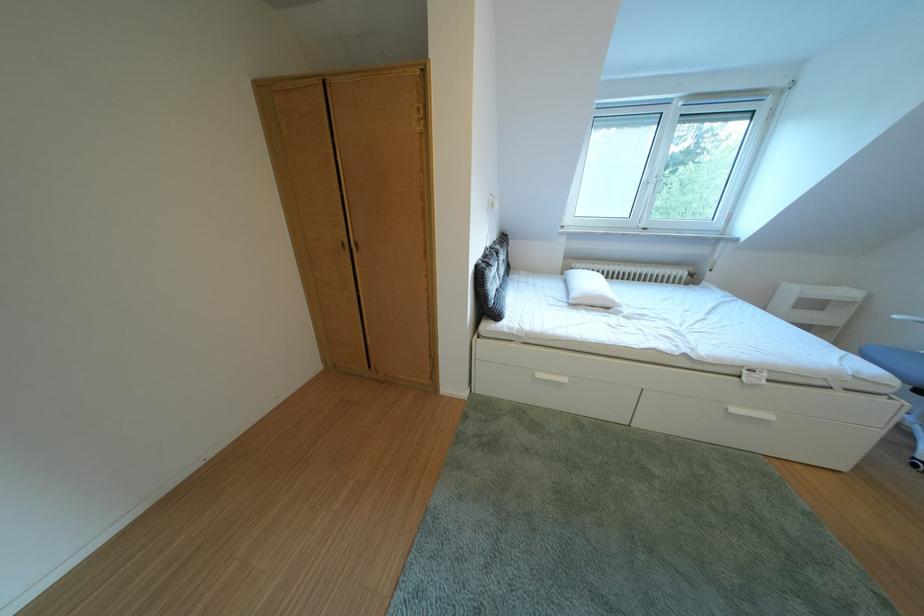
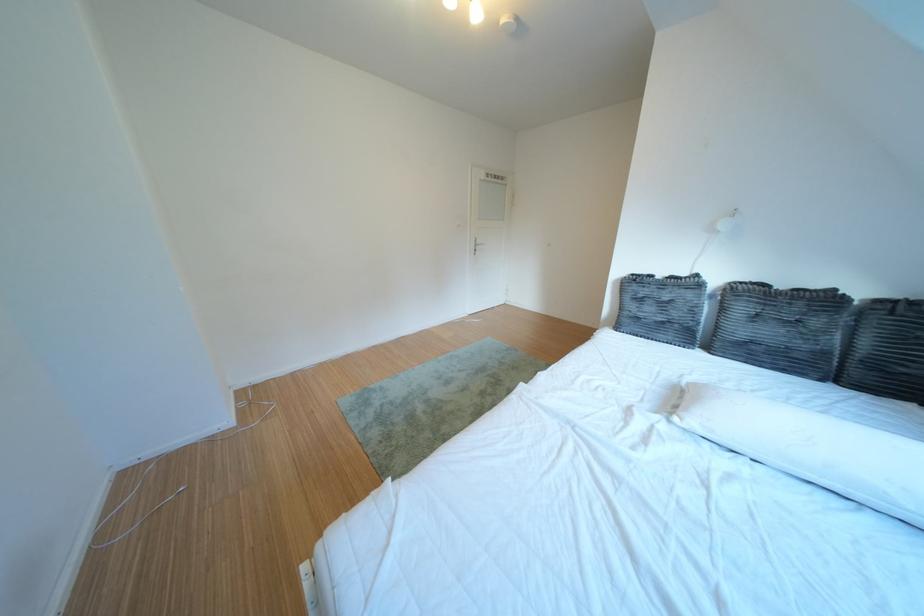
Question: I am providing you with two images of the same scene from different viewpoints. Please identify which objects are invisible in image2.

Choices:
 (A) grey tufted pillow
 (B) magazine in bin
 (C) white long pillow
 (D) cabinet handle

Answer: (D)